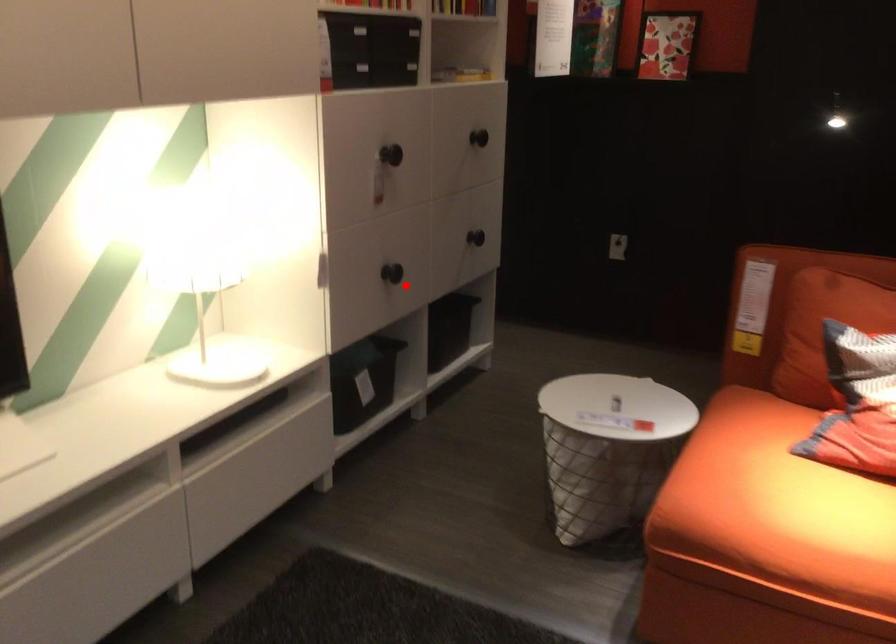
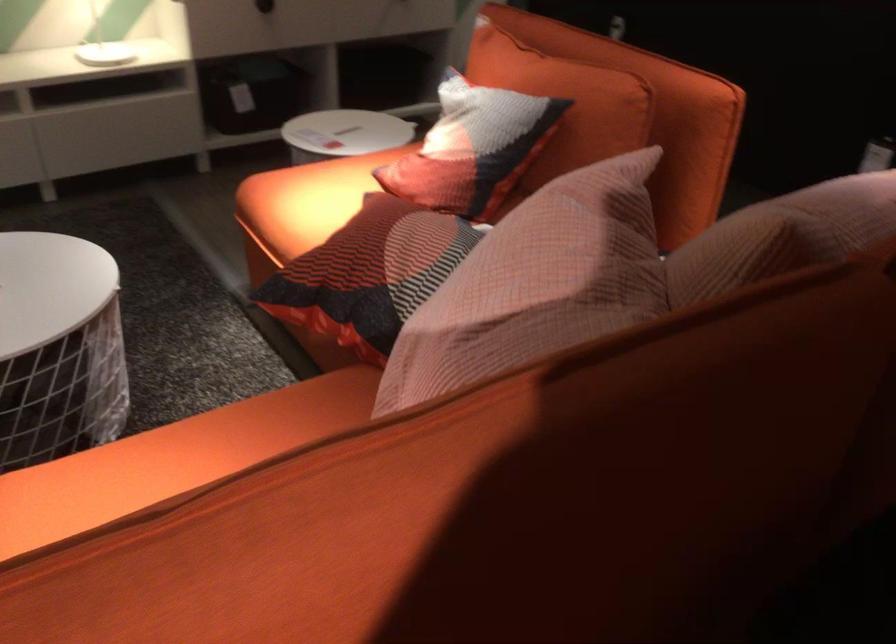
Question: I am providing you with two images of the same scene from different viewpoints. In image1, a red point is highlighted. Considering the same 3D point in image2, which of the following is correct?

Choices:
 (A) It is closer
 (B) It is farther

Answer: (B)